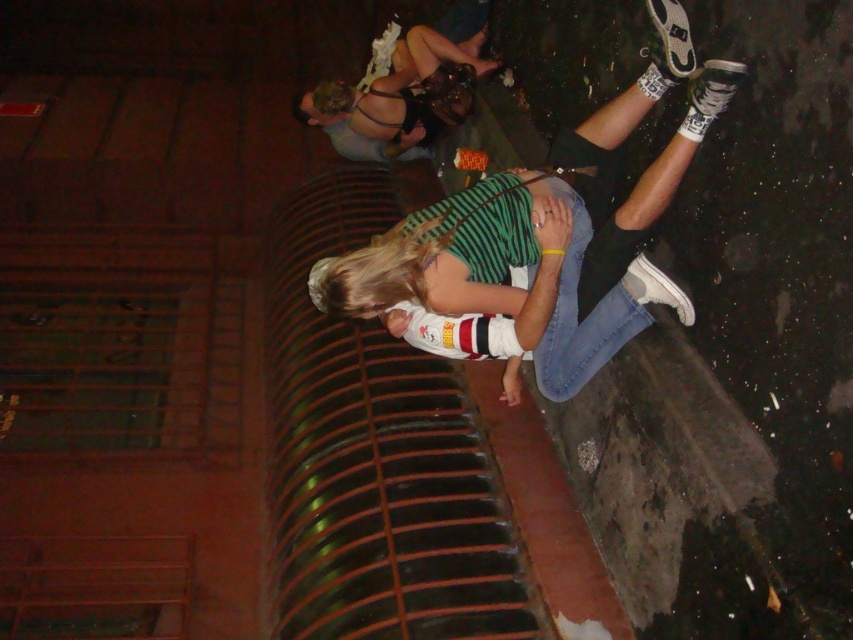
Consider the image. Does white matte sneakers at center appear on the left side of black leather dress at upper center?

In fact, white matte sneakers at center is to the right of black leather dress at upper center.

Between white matte sneakers at center and black leather dress at upper center, which one appears on the left side from the viewer's perspective?

black leather dress at upper center

Between point (668, 68) and point (408, 129), which one is positioned behind?

The point (408, 129) is behind.

This screenshot has width=853, height=640. I want to click on white matte sneakers at center, so click(543, 218).